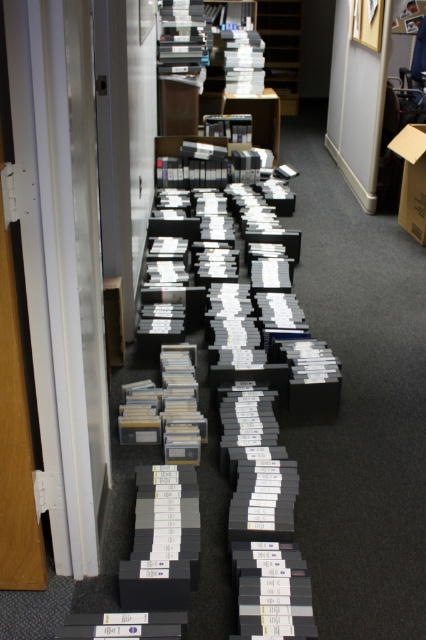
Between matte black bookshelf at upper center and cardboard box at center-right, which one is positioned lower?

cardboard box at center-right is lower down.

Can you confirm if matte black bookshelf at upper center is thinner than cardboard box at center-right?

Incorrect, matte black bookshelf at upper center's width is not less than cardboard box at center-right's.

Does point (268, 28) come in front of point (423, 202)?

No.

You are a GUI agent. You are given a task and a screenshot of the screen. Output one action in this format:
    pyautogui.click(x=<x>, y=<y>)
    Task: Click on the matte black bookshelf at upper center
    
    Given the screenshot: What is the action you would take?
    pyautogui.click(x=282, y=48)